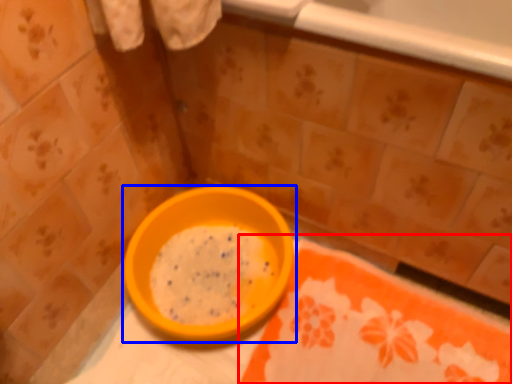
Question: Among these objects, which one is nearest to the camera, tablecloth (highlighted by a red box) or bowl (highlighted by a blue box)?

Choices:
 (A) tablecloth
 (B) bowl

Answer: (A)